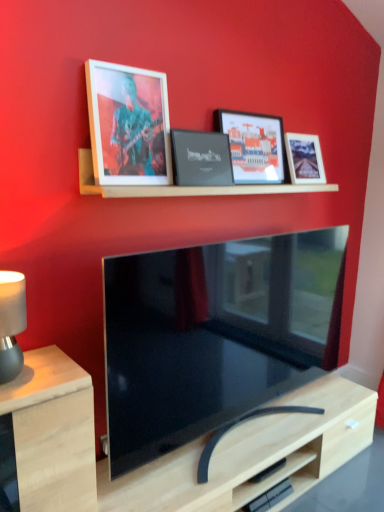
Where is `matte wooden picture frame at upper left, positioned as the 4th picture frame in right-to-left order`? The width and height of the screenshot is (384, 512). matte wooden picture frame at upper left, positioned as the 4th picture frame in right-to-left order is located at coordinates (128, 125).

Measure the distance between point (16,323) and camera.

The distance of point (16,323) from camera is 1.29 meters.

The width and height of the screenshot is (384, 512). What do you see at coordinates (11, 323) in the screenshot?
I see `matte black lampshade at left` at bounding box center [11, 323].

Identify the location of matte black picture frame at upper center, positioned as the third picture frame in left-to-right order. (254, 146).

In order to click on black matte picture frame at center, placed as the third picture frame when sorted from right to left in this screenshot , I will do `click(201, 158)`.

Based on the photo, how much space does black matte picture frame at center, which is the 2th picture frame from left to right, occupy vertically?

black matte picture frame at center, which is the 2th picture frame from left to right, is 9.18 inches tall.

What do you see at coordinates (53, 432) in the screenshot? The height and width of the screenshot is (512, 384). I see `light wood table at lower left` at bounding box center [53, 432].

Locate an element on the screen. This screenshot has height=512, width=384. matte wooden picture frame at upper left, positioned as the 4th picture frame in right-to-left order is located at coordinates (x=128, y=125).

Would you say matte black lampshade at left is inside or outside black matte picture frame at center, placed as the third picture frame when sorted from right to left?

matte black lampshade at left lies outside black matte picture frame at center, placed as the third picture frame when sorted from right to left.

Which is in front, point (14, 372) or point (205, 142)?

The point (14, 372) is in front.

Can you confirm if matte black lampshade at left is smaller than black matte picture frame at center, which is the 2th picture frame from left to right?

Actually, matte black lampshade at left might be larger than black matte picture frame at center, which is the 2th picture frame from left to right.

Does matte black lampshade at left turn towards black matte picture frame at center, which is the 2th picture frame from left to right?

No.

Can you confirm if matte black tv at center is bigger than light wood table at lower left?

Correct, matte black tv at center is larger in size than light wood table at lower left.

Is matte black tv at center next to light wood table at lower left?

No, matte black tv at center is not in contact with light wood table at lower left.

You are a GUI agent. You are given a task and a screenshot of the screen. Output one action in this format:
    pyautogui.click(x=<x>, y=<y>)
    Task: Click on the television that is behind the light wood table at lower left
    
    Given the screenshot: What is the action you would take?
    pyautogui.click(x=215, y=335)

Considering the positions of points (70, 418) and (257, 310), is point (70, 418) closer to camera compared to point (257, 310)?

Yes, it is in front of point (257, 310).

Does light wood table at lower left come in front of matte black tv at center?

Yes, it is in front of matte black tv at center.

Is light wood table at lower left smaller than matte black tv at center?

Correct, light wood table at lower left occupies less space than matte black tv at center.

Locate an element on the screen. table that appears below the matte black lampshade at left (from the image's perspective) is located at coordinates (53, 432).

Visually, is matte black lampshade at left positioned to the left or to the right of light wood table at lower left?

Based on their positions, matte black lampshade at left is located to the left of light wood table at lower left.

Can you confirm if matte black lampshade at left is bigger than light wood table at lower left?

No.

From a real-world perspective, who is located lower, wooden shelf at upper center or matte black tv at center?

matte black tv at center, from a real-world perspective.

This screenshot has height=512, width=384. I want to click on shelf above the matte black tv at center (from a real-world perspective), so click(182, 186).

Does wooden shelf at upper center have a greater width compared to matte black tv at center?

Yes, wooden shelf at upper center is wider than matte black tv at center.

Is point (252, 185) positioned in front of point (337, 279)?

Yes, it is in front of point (337, 279).

Considering the relative positions of wooden shelf at upper center and light wood table at lower left in the image provided, is wooden shelf at upper center in front of light wood table at lower left?

No.

The image size is (384, 512). I want to click on shelf above the light wood table at lower left (from a real-world perspective), so click(182, 186).

How different are the orientations of wooden shelf at upper center and light wood table at lower left in degrees?

0.157 degrees separate the facing orientations of wooden shelf at upper center and light wood table at lower left.

Is the surface of wooden shelf at upper center in direct contact with light wood table at lower left?

No, wooden shelf at upper center is not touching light wood table at lower left.

Which picture frame is the 1st one when counting from the right side of the light wood table at lower left? Please provide its 2D coordinates.

[(128, 125)]

Which of these two, matte wooden picture frame at upper left, positioned as the 4th picture frame in right-to-left order, or light wood table at lower left, is wider?

Wider between the two is light wood table at lower left.

Considering the relative sizes of matte wooden picture frame at upper left, positioned as the 4th picture frame in right-to-left order, and light wood table at lower left in the image provided, is matte wooden picture frame at upper left, positioned as the 4th picture frame in right-to-left order, shorter than light wood table at lower left?

Indeed, matte wooden picture frame at upper left, positioned as the 4th picture frame in right-to-left order, has a lesser height compared to light wood table at lower left.

From the picture: From a real-world perspective, between matte wooden picture frame at upper left, positioned as the 4th picture frame in right-to-left order, and light wood table at lower left, who is vertically higher?

matte wooden picture frame at upper left, positioned as the 4th picture frame in right-to-left order, is physically above.

In order to click on the 1st picture frame positioned above the matte black lampshade at left (from the image's perspective) in this screenshot , I will do 201,158.

Find the location of `table in front of the matte black tv at center`. table in front of the matte black tv at center is located at coordinates (53, 432).

In the scene shown: Based on their spatial positions, is matte white picture frame at upper right, placed as the 4th picture frame when sorted from left to right, or wooden shelf at upper center further from matte black lampshade at left?

The object further to matte black lampshade at left is matte white picture frame at upper right, placed as the 4th picture frame when sorted from left to right.

Based on their spatial positions, is matte black tv at center or wooden shelf at upper center closer to black matte picture frame at center, placed as the third picture frame when sorted from right to left?

wooden shelf at upper center lies closer to black matte picture frame at center, placed as the third picture frame when sorted from right to left, than the other object.

Considering their positions, is wooden shelf at upper center positioned further to light wood table at lower left than matte white picture frame at upper right, placed as the 4th picture frame when sorted from left to right?

matte white picture frame at upper right, placed as the 4th picture frame when sorted from left to right.

Looking at the image, which one is located further to light wood table at lower left, wooden shelf at upper center or matte black tv at center?

The object further to light wood table at lower left is wooden shelf at upper center.

Based on their spatial positions, is black matte picture frame at center, which is the 2th picture frame from left to right, or matte black picture frame at upper center, arranged as the second picture frame when viewed from the right, further from matte black tv at center?

matte black picture frame at upper center, arranged as the second picture frame when viewed from the right, is further to matte black tv at center.

Which object lies further to the anchor point matte black picture frame at upper center, positioned as the third picture frame in left-to-right order, light wood table at lower left or matte black tv at center?

light wood table at lower left is further to matte black picture frame at upper center, positioned as the third picture frame in left-to-right order.

When comparing their distances from matte wooden picture frame at upper left, acting as the first picture frame starting from the left, does black matte picture frame at center, placed as the third picture frame when sorted from right to left, or wooden shelf at upper center seem closer?

black matte picture frame at center, placed as the third picture frame when sorted from right to left, is closer to matte wooden picture frame at upper left, acting as the first picture frame starting from the left.

In the scene shown: Estimate the real-world distances between objects in this image. Which object is further from black matte picture frame at center, which is the 2th picture frame from left to right, wooden shelf at upper center or light wood table at lower left?

light wood table at lower left.

At what (x,y) coordinates should I click in order to perform the action: click on television between matte black picture frame at upper center, positioned as the third picture frame in left-to-right order, and light wood table at lower left from top to bottom. Please return your answer as a coordinate pair (x, y). Looking at the image, I should click on (215, 335).

You are a GUI agent. You are given a task and a screenshot of the screen. Output one action in this format:
    pyautogui.click(x=<x>, y=<y>)
    Task: Click on the television between wooden shelf at upper center and light wood table at lower left in the vertical direction
    
    Given the screenshot: What is the action you would take?
    pyautogui.click(x=215, y=335)

Find the location of `shelf that lies between black matte picture frame at center, placed as the third picture frame when sorted from right to left, and light wood table at lower left from top to bottom`. shelf that lies between black matte picture frame at center, placed as the third picture frame when sorted from right to left, and light wood table at lower left from top to bottom is located at coordinates (182, 186).

Find the location of a particular element. Image resolution: width=384 pixels, height=512 pixels. shelf between matte wooden picture frame at upper left, positioned as the 4th picture frame in right-to-left order, and matte black picture frame at upper center, arranged as the second picture frame when viewed from the right, in the horizontal direction is located at coordinates (182, 186).